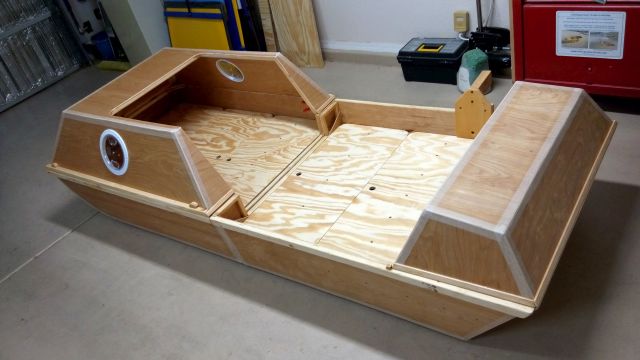
Where is `floor`? This screenshot has height=360, width=640. floor is located at coordinates (93, 302).